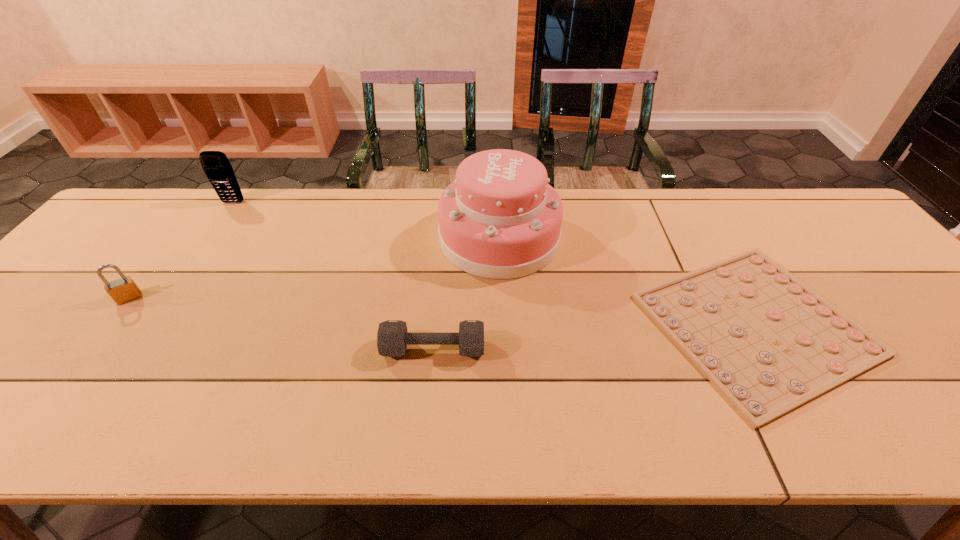
This screenshot has height=540, width=960. What are the coordinates of `vacant space positioned on the front of the leftmost object` in the screenshot? It's located at (93, 346).

Image resolution: width=960 pixels, height=540 pixels. I want to click on vacant space located on the right of the fourth tallest object, so click(x=528, y=348).

I want to click on free region located on the left of the shortest object, so click(593, 324).

Identify the location of birthday cake that is positioned at the far edge. (500, 219).

Locate an element on the screen. Image resolution: width=960 pixels, height=540 pixels. cellular telephone that is positioned at the far edge is located at coordinates (216, 166).

Find the location of a particular element. object at the near edge is located at coordinates (769, 343).

Image resolution: width=960 pixels, height=540 pixels. Identify the location of vacant space at the far edge of the desktop. (584, 202).

The height and width of the screenshot is (540, 960). What are the coordinates of `vacant space at the near edge of the desktop` in the screenshot? It's located at 740,436.

You are a GUI agent. You are given a task and a screenshot of the screen. Output one action in this format:
    pyautogui.click(x=<x>, y=<y>)
    Task: Click on the free space at the left edge of the desktop
    The image size is (960, 540).
    Given the screenshot: What is the action you would take?
    pyautogui.click(x=127, y=273)

At what (x,y) coordinates should I click in order to perform the action: click on vacant space at the right edge of the desktop. Please return your answer as a coordinate pair (x, y). The image size is (960, 540). Looking at the image, I should click on (937, 366).